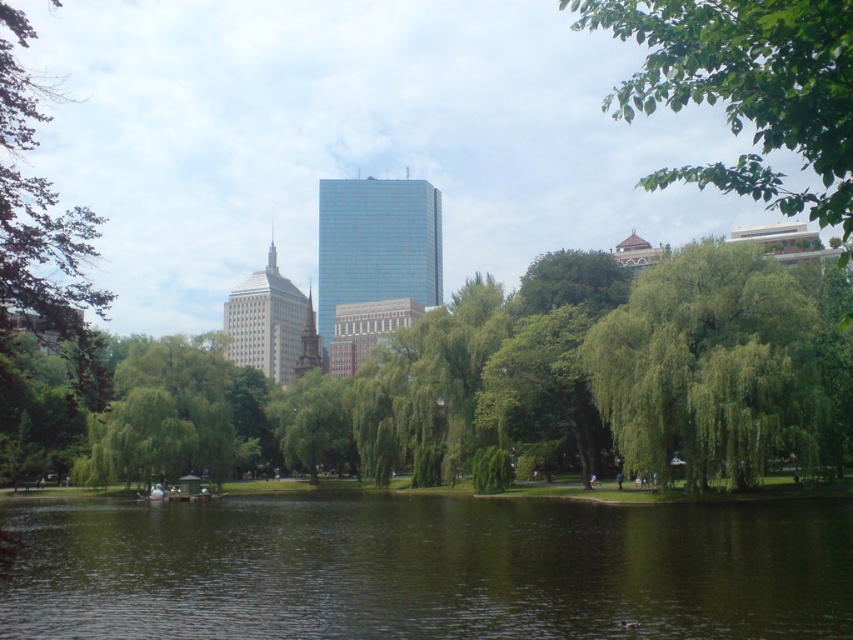
Consider the image. Is green leafy tree at center wider than green leafy tree at upper right?

In fact, green leafy tree at center might be narrower than green leafy tree at upper right.

Between green leafy tree at center and green leafy tree at upper right, which one appears on the left side from the viewer's perspective?

green leafy tree at center is more to the left.

Who is more distant from viewer, (596, 408) or (845, 77)?

The point (596, 408) is more distant.

Find the location of a particular element. The width and height of the screenshot is (853, 640). green leafy tree at center is located at coordinates (711, 365).

Which is above, green reflective water at center or green leafy tree at center?

green leafy tree at center is above.

Between green reflective water at center and green leafy tree at center, which one is positioned lower?

green reflective water at center

Does point (419, 528) come behind point (670, 435)?

No, it is not.

The width and height of the screenshot is (853, 640). I want to click on green reflective water at center, so click(x=428, y=570).

Does green reflective water at center have a larger size compared to green leafy tree at upper right?

No.

Is green reflective water at center thinner than green leafy tree at upper right?

Indeed, green reflective water at center has a lesser width compared to green leafy tree at upper right.

Locate an element on the screen. The width and height of the screenshot is (853, 640). green reflective water at center is located at coordinates pyautogui.click(x=428, y=570).